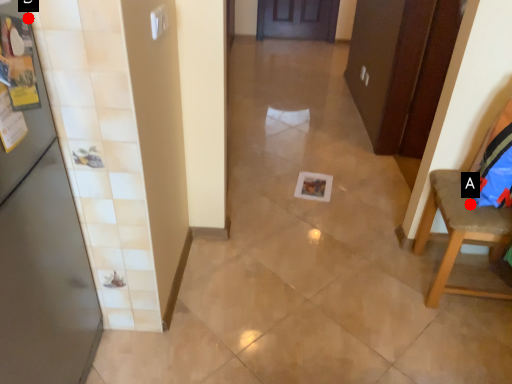
Question: Two points are circled on the image, labeled by A and B beside each circle. Which point is closer to the camera?

Choices:
 (A) A is closer
 (B) B is closer

Answer: (B)